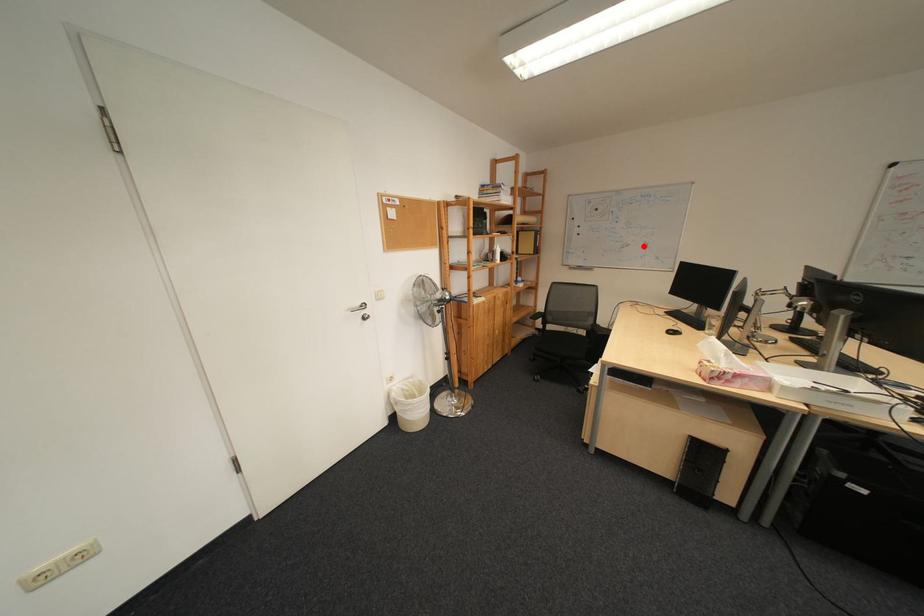
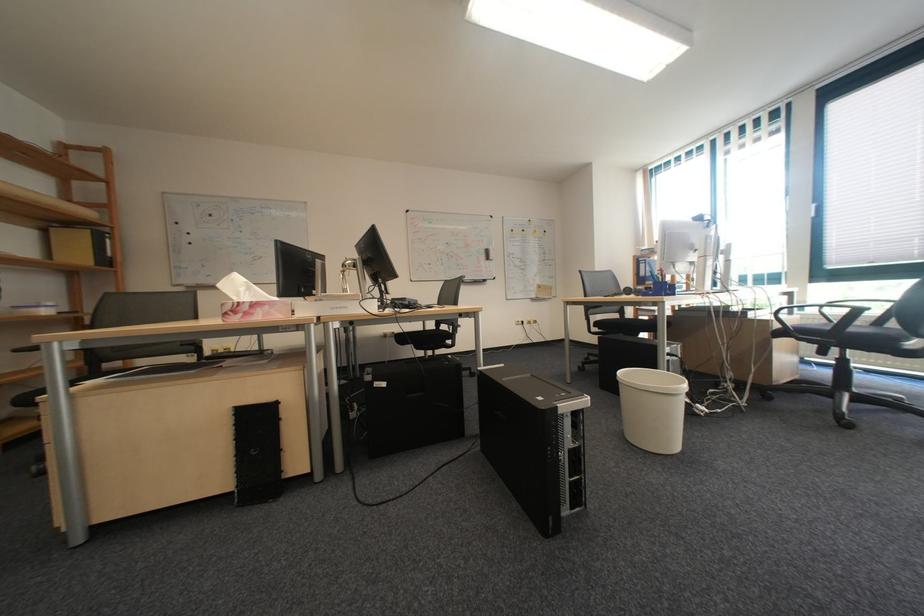
Where in the second image is the point corresponding to the highlighted location from the first image?

(275, 257)